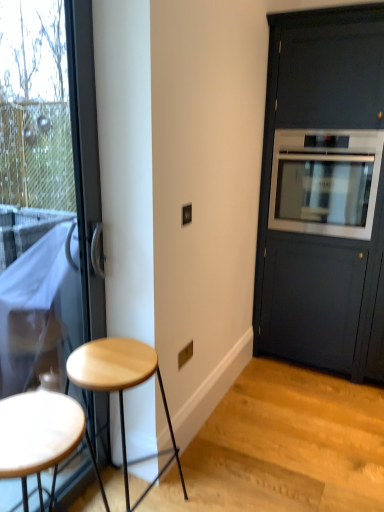
Question: Is matte black cabinet at right completely or partially outside of light wood stool at lower left, the second stool viewed from the front?

Choices:
 (A) yes
 (B) no

Answer: (A)

Question: From the image's perspective, does matte black cabinet at right appear lower than light wood stool at lower left, the second stool viewed from the front?

Choices:
 (A) yes
 (B) no

Answer: (B)

Question: Can you confirm if matte black cabinet at right is wider than light wood stool at lower left, the first stool from the back?

Choices:
 (A) no
 (B) yes

Answer: (B)

Question: Does matte black cabinet at right have a smaller size compared to light wood stool at lower left, the first stool from the back?

Choices:
 (A) yes
 (B) no

Answer: (B)

Question: From the image's perspective, is matte black cabinet at right on top of light wood stool at lower left, the first stool from the back?

Choices:
 (A) yes
 (B) no

Answer: (A)

Question: Would you say matte black cabinet at right is inside or outside satin silver oven at right?

Choices:
 (A) inside
 (B) outside

Answer: (B)

Question: Is point (301, 324) positioned closer to the camera than point (327, 197)?

Choices:
 (A) closer
 (B) farther

Answer: (B)

Question: Is matte black cabinet at right in front of or behind satin silver oven at right in the image?

Choices:
 (A) front
 (B) behind

Answer: (A)

Question: Considering the positions of matte black cabinet at right and satin silver oven at right in the image, is matte black cabinet at right bigger or smaller than satin silver oven at right?

Choices:
 (A) small
 (B) big

Answer: (B)

Question: Which is correct: light wood stool at lower left, the first stool from the back, is inside transparent glass door at left, or outside of it?

Choices:
 (A) inside
 (B) outside

Answer: (B)

Question: Based on their sizes in the image, would you say light wood stool at lower left, the second stool viewed from the front, is bigger or smaller than transparent glass door at left?

Choices:
 (A) small
 (B) big

Answer: (A)

Question: Considering the relative positions of light wood stool at lower left, the first stool from the back, and transparent glass door at left in the image provided, is light wood stool at lower left, the first stool from the back, to the left or to the right of transparent glass door at left?

Choices:
 (A) right
 (B) left

Answer: (A)

Question: Considering the positions of light wood stool at lower left, the first stool from the back, and transparent glass door at left in the image, is light wood stool at lower left, the first stool from the back, taller or shorter than transparent glass door at left?

Choices:
 (A) tall
 (B) short

Answer: (B)

Question: Looking at their shapes, would you say wooden stool at left, which appears as the second stool when viewed from the back, is wider or thinner than matte black cabinet at right?

Choices:
 (A) wide
 (B) thin

Answer: (B)

Question: In the image, is wooden stool at left, which appears as the second stool when viewed from the back, on the left side or the right side of matte black cabinet at right?

Choices:
 (A) left
 (B) right

Answer: (A)